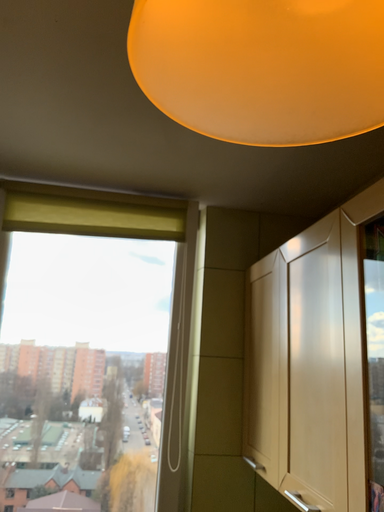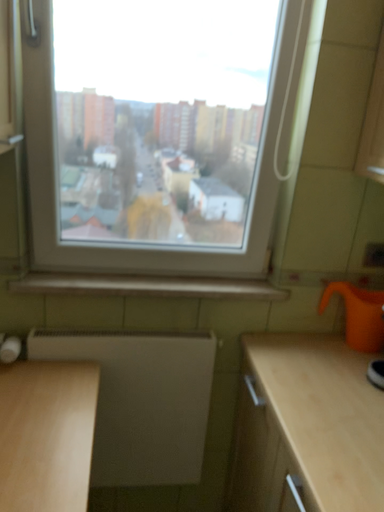
Question: How did the camera likely rotate when shooting the video?

Choices:
 (A) rotated upward
 (B) rotated downward

Answer: (B)